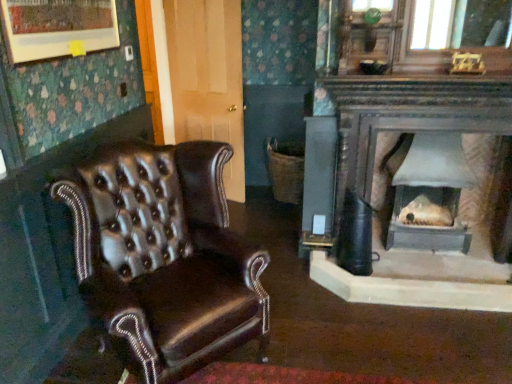
Question: Can you confirm if shiny brown leather chair at left is thinner than matte gray wood burning stove at center?

Choices:
 (A) yes
 (B) no

Answer: (B)

Question: From the image's perspective, is shiny brown leather chair at left on top of matte gray wood burning stove at center?

Choices:
 (A) yes
 (B) no

Answer: (B)

Question: Is shiny brown leather chair at left positioned beyond the bounds of matte gray wood burning stove at center?

Choices:
 (A) yes
 (B) no

Answer: (A)

Question: Considering the relative sizes of shiny brown leather chair at left and matte gray wood burning stove at center in the image provided, is shiny brown leather chair at left smaller than matte gray wood burning stove at center?

Choices:
 (A) no
 (B) yes

Answer: (A)

Question: Does shiny brown leather chair at left have a greater height compared to matte gray wood burning stove at center?

Choices:
 (A) yes
 (B) no

Answer: (A)

Question: From a real-world perspective, does shiny brown leather chair at left sit lower than matte gray wood burning stove at center?

Choices:
 (A) no
 (B) yes

Answer: (A)

Question: From a real-world perspective, is matte gray wood burning stove at center positioned over shiny brown leather chair at left based on gravity?

Choices:
 (A) yes
 (B) no

Answer: (B)

Question: Is matte gray wood burning stove at center aimed at shiny brown leather chair at left?

Choices:
 (A) no
 (B) yes

Answer: (A)

Question: Does matte gray wood burning stove at center lie behind shiny brown leather chair at left?

Choices:
 (A) yes
 (B) no

Answer: (A)

Question: Is shiny brown leather chair at left a part of matte gray wood burning stove at center?

Choices:
 (A) yes
 (B) no

Answer: (B)

Question: Is the position of matte gray wood burning stove at center less distant than that of shiny brown leather chair at left?

Choices:
 (A) no
 (B) yes

Answer: (A)

Question: Is matte gray wood burning stove at center placed right next to shiny brown leather chair at left?

Choices:
 (A) no
 (B) yes

Answer: (A)

Question: In terms of width, does matte gray wood burning stove at center look wider or thinner when compared to shiny brown leather chair at left?

Choices:
 (A) thin
 (B) wide

Answer: (A)